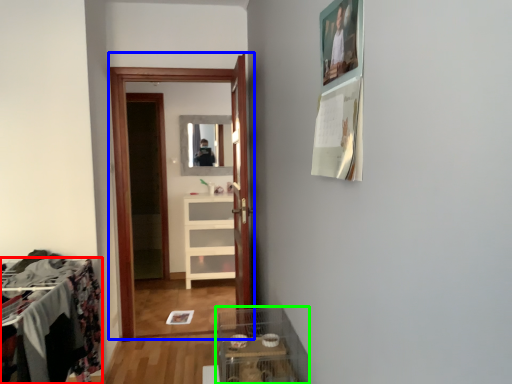
Question: Which object is the farthest from furniture (highlighted by a red box)? Choose among these: clothing store (highlighted by a blue box) or glass box (highlighted by a green box).

Choices:
 (A) clothing store
 (B) glass box

Answer: (A)